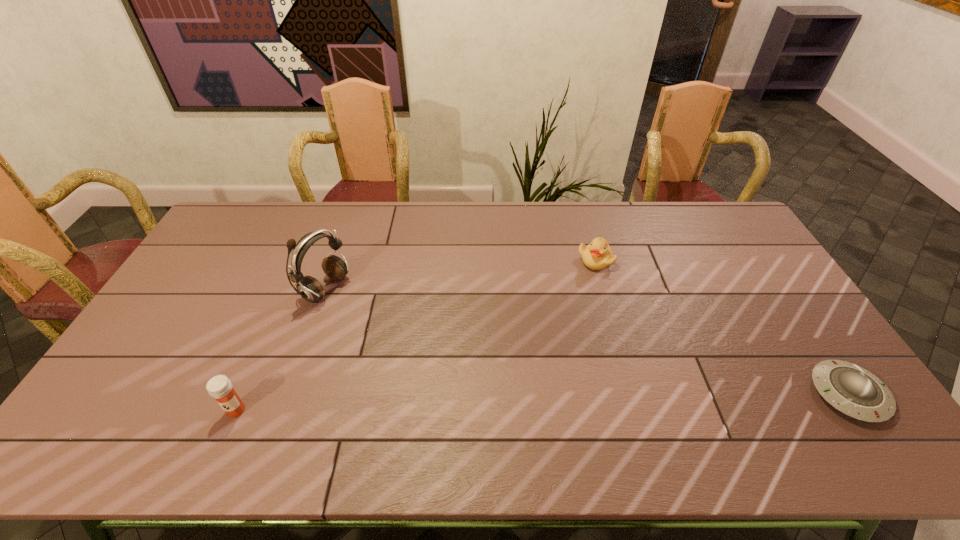
Identify the location of vacant space on the desktop that is between the third shortest object and the shortest object and is positioned on the ear pads of the earphone. The image size is (960, 540). (575, 401).

In order to click on free spot on the desktop that is between the medicine and the saucer and is positioned on the beak of the second shortest object in this screenshot , I will do `click(629, 400)`.